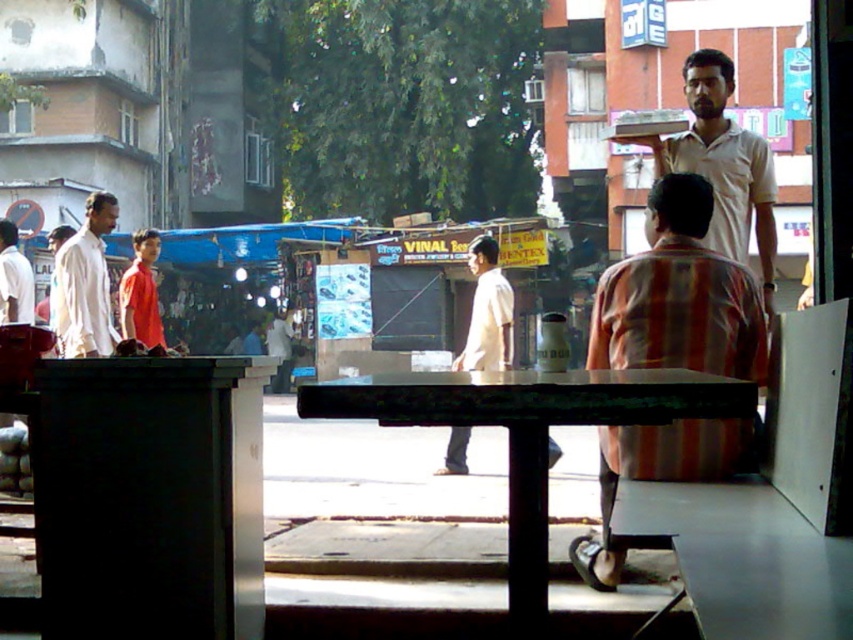
You are standing at the point with coordinates point (717, 147) and want to walk to the point with coordinates point (74, 349). Given the scene described, will you have an unobstructed path to walk directly towards your destination?

Point (717, 147) is in front of point (74, 349), so walking directly towards point (74, 349) from point (717, 147) would require moving backward, which means the path is obstructed by the dark green table in the foreground.

You are standing at the window and see the scene outside. There is a point marked at coordinates (679, 296). What object is located at that point?

The striped cotton shirt at center is located at point (679, 296).

You are standing inside a building looking through a window. There is a dark green table with a reflective surface in front of you. A man in a striped cotton shirt is sitting at the table facing away. To your left, there are two men near a blue canopy shop. Can you determine the spatial relationship between the striped cotton shirt at center and the blue canopy shop in the scene?

The striped cotton shirt at center is located at point (679, 296). Since the blue canopy shop is mentioned to be to the left in the midground, the striped cotton shirt at center is closer to the viewer compared to the blue canopy shop.